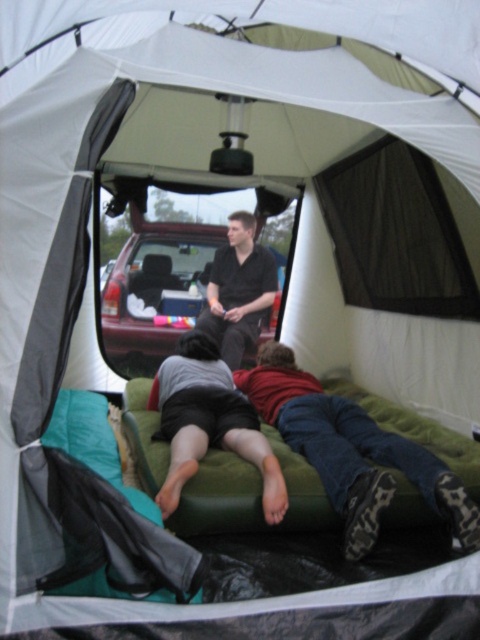
Measure the distance between matte red car at center and camera.

A distance of 13.42 feet exists between matte red car at center and camera.

Is matte red car at center to the left of gray fabric shorts at center from the viewer's perspective?

Correct, you'll find matte red car at center to the left of gray fabric shorts at center.

Is point (128, 285) closer to camera compared to point (229, 387)?

No, it is behind (229, 387).

Locate an element on the screen. The height and width of the screenshot is (640, 480). matte red car at center is located at coordinates [156, 291].

Is point (355, 404) positioned in front of point (159, 244)?

Yes, point (355, 404) is closer to viewer.

This screenshot has height=640, width=480. In order to click on denim jeans at lower center in this screenshot , I will do `click(351, 451)`.

Who is shorter, matte red car at center or black matte shirt at center?

black matte shirt at center is shorter.

Between matte red car at center and black matte shirt at center, which one has more height?

matte red car at center

Where is `matte red car at center`? This screenshot has width=480, height=640. matte red car at center is located at coordinates (156, 291).